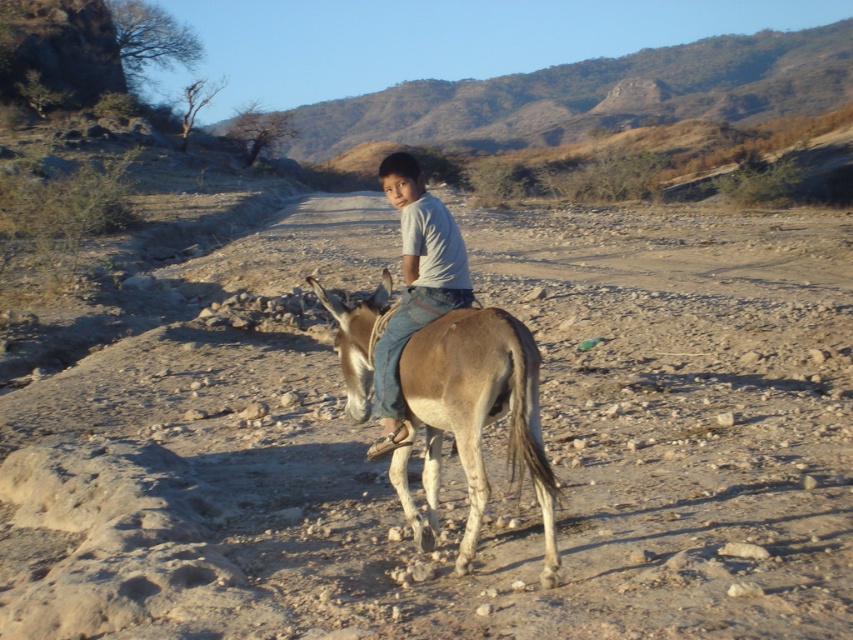
You are a photographer trying to capture the light brown textured mule at center and the light blue denim jeans at center in a single frame. Since the mule is narrower than the jeans, will you need to adjust your camera angle to include both subjects fully?

The light brown textured mule at center has a lesser width compared to the light blue denim jeans at center. To capture both subjects fully in one frame, you may need to adjust your camera angle to accommodate the wider jeans.

You are standing on the dirt path and want to take a photo of the light brown textured mule at center. If your camera has a minimum focusing distance of 3 meters, will you be able to take a clear photo without moving closer?

The light brown textured mule at center is 3.18 meters from viewer, which is slightly beyond the camera minimum focusing distance of 3 meters. Therefore, you need to move a bit closer to ensure the photo is clear.